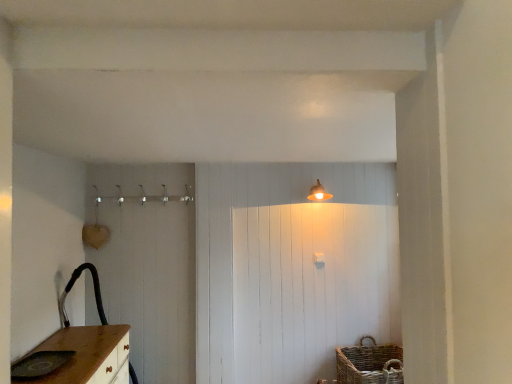
Question: Looking at the image, does woven brown basket at lower right seem bigger or smaller compared to matte gold light fixture at upper center?

Choices:
 (A) small
 (B) big

Answer: (B)

Question: From a real-world perspective, is woven brown basket at lower right positioned above or below matte gold light fixture at upper center?

Choices:
 (A) below
 (B) above

Answer: (A)

Question: Which object is positioned farthest from the matte gold light fixture at upper center?

Choices:
 (A) matte gray sink at lower left
 (B) woven brown basket at lower right

Answer: (A)

Question: Estimate the real-world distances between objects in this image. Which object is closer to the matte gold light fixture at upper center?

Choices:
 (A) woven brown basket at lower right
 (B) matte gray sink at lower left

Answer: (A)